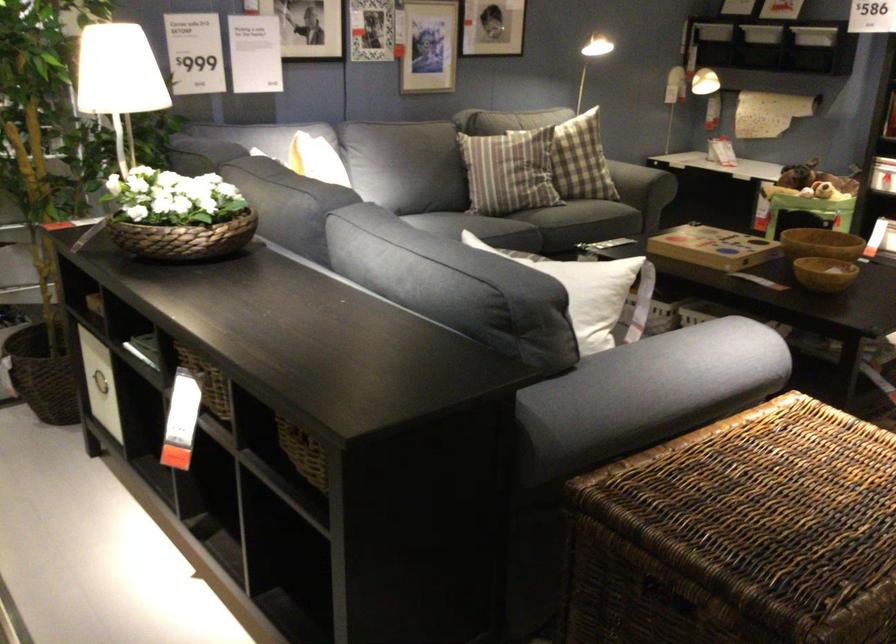
Image resolution: width=896 pixels, height=644 pixels. I want to click on striped pillow, so click(x=581, y=160).